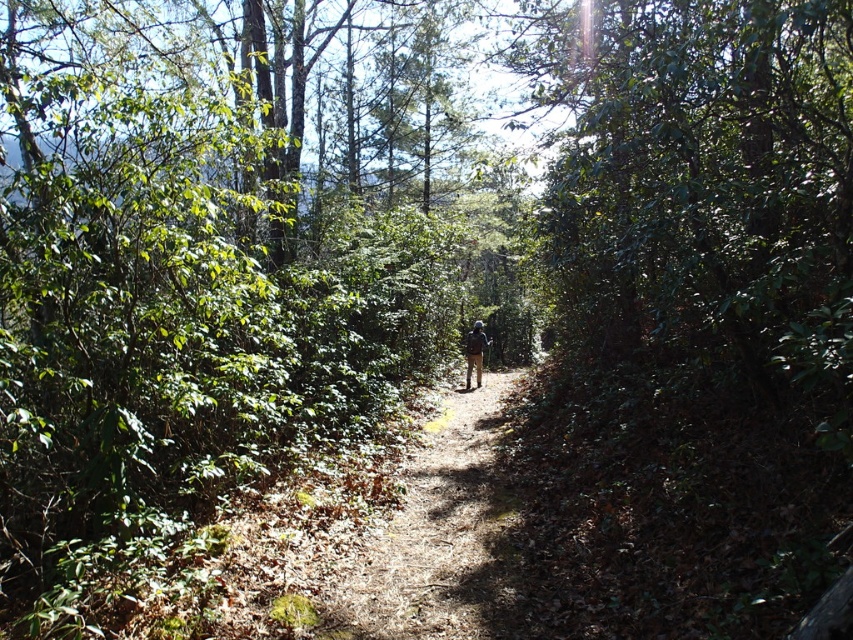
Which is behind, point (407, 547) or point (465, 349)?

The point (465, 349) is more distant.

Can you confirm if brown dirt path at center is positioned below dark green backpack at center?

Indeed, brown dirt path at center is positioned under dark green backpack at center.

The image size is (853, 640). Identify the location of brown dirt path at center. (432, 532).

What are the coordinates of `brown dirt path at center` in the screenshot? It's located at (432, 532).